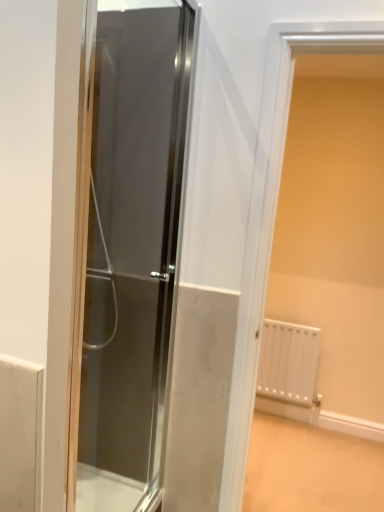
Question: Relative to white matte radiator at right, is transparent glass door at center in front or behind?

Choices:
 (A) front
 (B) behind

Answer: (A)

Question: Is transparent glass door at center spatially inside white matte radiator at right, or outside of it?

Choices:
 (A) outside
 (B) inside

Answer: (A)

Question: From the image's perspective, relative to white matte radiator at right, is transparent glass door at center above or below?

Choices:
 (A) above
 (B) below

Answer: (A)

Question: From a real-world perspective, is white matte radiator at right physically located above or below transparent glass door at center?

Choices:
 (A) below
 (B) above

Answer: (A)

Question: Looking at the image, does white matte radiator at right seem bigger or smaller compared to transparent glass door at center?

Choices:
 (A) small
 (B) big

Answer: (B)

Question: Does point (268, 208) appear closer or farther from the camera than point (97, 254)?

Choices:
 (A) closer
 (B) farther

Answer: (A)

Question: Relative to transparent glass door at center, is white matte radiator at right in front or behind?

Choices:
 (A) front
 (B) behind

Answer: (B)